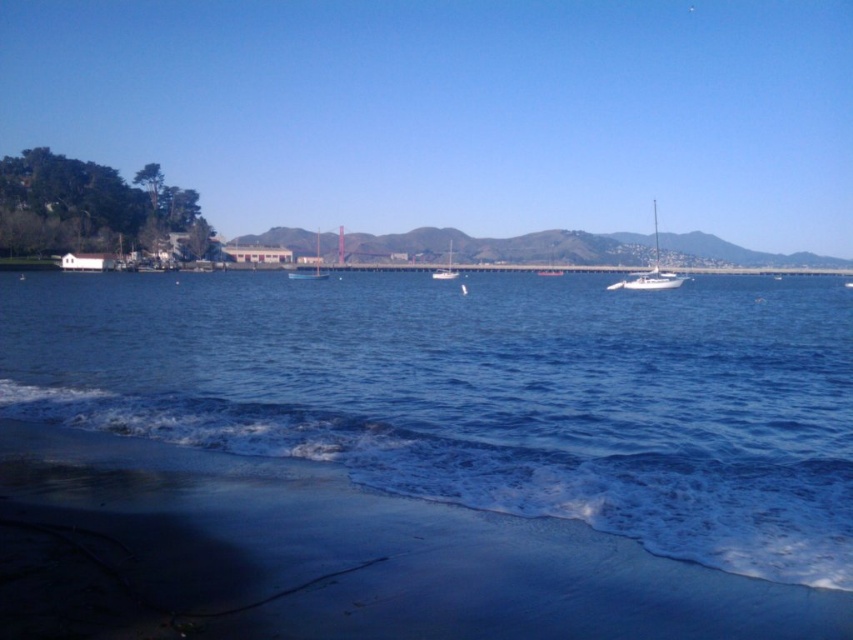
Is point (293, 272) less distant than point (432, 276)?

No, (293, 272) is further to viewer.

Does metallic sailboat at center have a lesser height compared to white matte sailboat at center?

In fact, metallic sailboat at center may be taller than white matte sailboat at center.

In order to click on metallic sailboat at center in this screenshot , I will do `click(310, 272)`.

Is metallic sailboat at center smaller than blue plastic boat at center?

No.

Does metallic sailboat at center have a greater height compared to blue plastic boat at center?

Yes, metallic sailboat at center is taller than blue plastic boat at center.

Which is behind, point (318, 259) or point (300, 273)?

Point (318, 259)

Image resolution: width=853 pixels, height=640 pixels. I want to click on metallic sailboat at center, so click(x=310, y=272).

Is point (622, 280) behind point (306, 276)?

No.

Which is behind, point (659, 268) or point (320, 276)?

The point (659, 268) is behind.

Find the location of `white glossy sailboat at right`. white glossy sailboat at right is located at coordinates (650, 272).